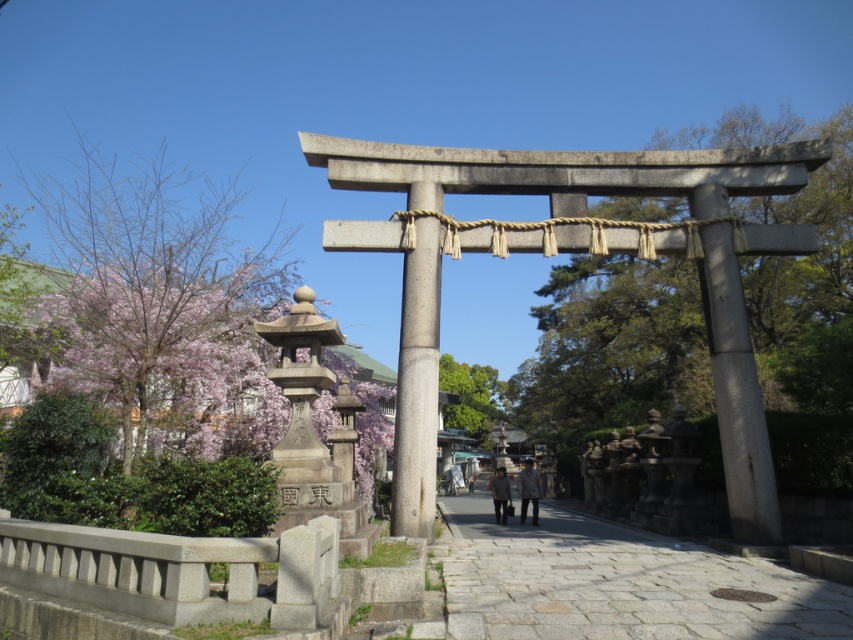
You are standing at the entrance of a Shinto shrine and see the smooth gray pole at center and the dark gray jacket at center. You want to place a 5.5 meter long decorative banner between them. Will the banner fit between the two objects without overlapping?

The smooth gray pole at center is 6.04 meters from the dark gray jacket at center. Since the banner is 5.5 meters long, it will fit between them without overlapping as the distance is greater than the banner length.

You are a visitor at a Shinto shrine and want to take a photo of the smooth gray stone torii gate at center and the smooth gray pole at center. Which object should you focus on first if you want to capture both in a single frame without moving your camera?

You should focus on the smooth gray stone torii gate at center first because it is larger than the smooth gray pole at center, so it will take up more space in the frame.

You are standing at the entrance of a Shinto shrine and see the smooth gray pole at center and the dark gray jacket at center. Which object is located to the left of the other?

The smooth gray pole at center is positioned on the left side of dark gray jacket at center.